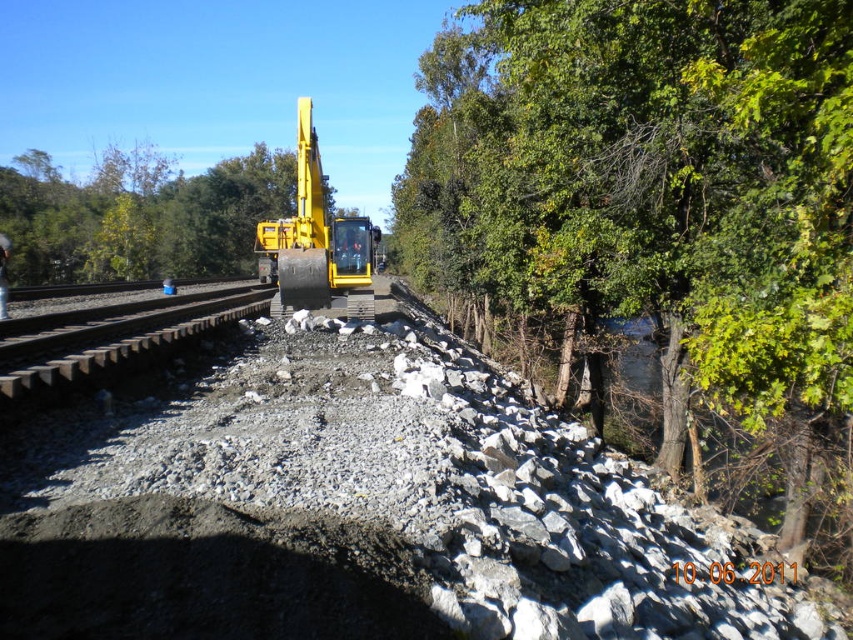
From the picture: Is the position of gray gravel train track at left less distant than that of yellow metallic excavator at center?

Yes, gray gravel train track at left is in front of yellow metallic excavator at center.

Between point (123, 333) and point (285, 282), which one is positioned in front?

Positioned in front is point (123, 333).

Where is `gray gravel train track at left`? The image size is (853, 640). gray gravel train track at left is located at coordinates (111, 333).

Does green leafy tree at upper right have a smaller size compared to yellow metallic excavator at center?

Yes, green leafy tree at upper right is smaller than yellow metallic excavator at center.

Is point (828, 192) positioned before point (309, 257)?

That is True.

Where is `green leafy tree at upper right`? This screenshot has height=640, width=853. green leafy tree at upper right is located at coordinates (654, 208).

Who is positioned more to the left, green leafy tree at center or gray gravel train track at left?

From the viewer's perspective, green leafy tree at center appears more on the left side.

Is green leafy tree at center shorter than gray gravel train track at left?

No, green leafy tree at center is not shorter than gray gravel train track at left.

Does point (96, 241) come farther from viewer compared to point (193, 320)?

Yes.

Identify the location of green leafy tree at center. (140, 216).